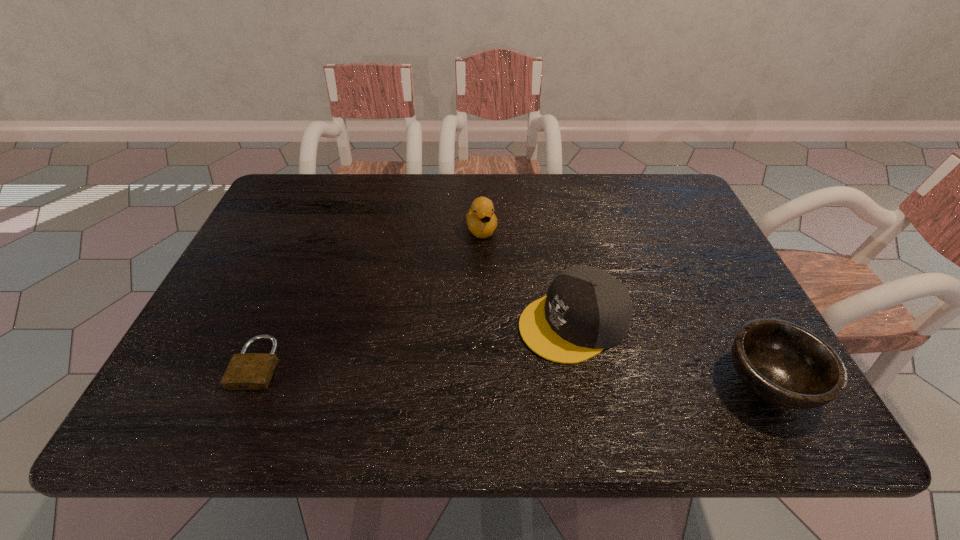
Locate an element on the screen. free point that satisfies the following two spatial constraints: 1. on the keyhole side of the shortest object; 2. on the left side of the bowl is located at coordinates (250, 382).

Locate an element on the screen. The height and width of the screenshot is (540, 960). vacant space that satisfies the following two spatial constraints: 1. on the keyhole side of the third tallest object; 2. on the right side of the shortest object is located at coordinates (250, 382).

This screenshot has width=960, height=540. I want to click on vacant area that satisfies the following two spatial constraints: 1. on the keyhole side of the rightmost object; 2. on the right side of the padlock, so click(x=250, y=382).